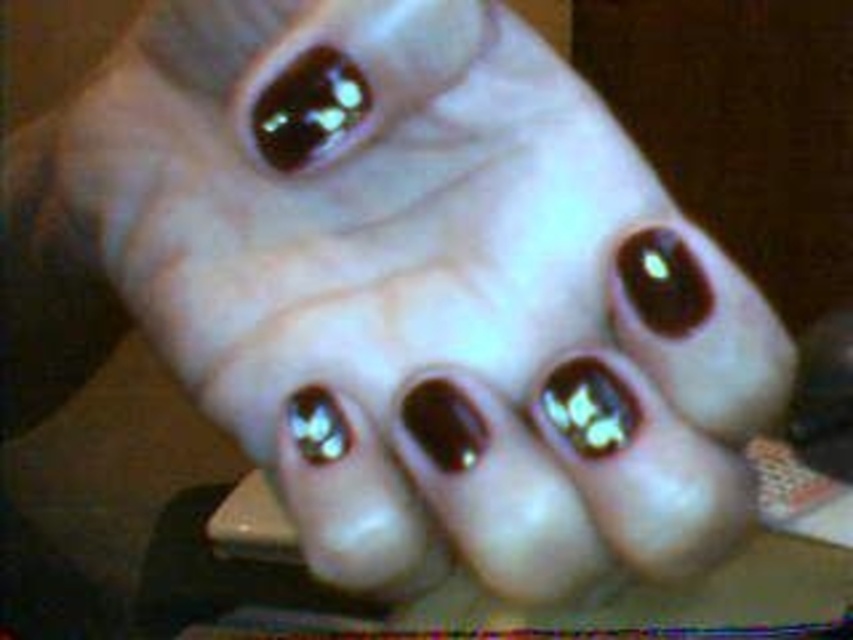
Which is in front, point (282, 161) or point (292, 403)?

Positioned in front is point (292, 403).

Is point (258, 104) positioned behind point (305, 432)?

That is True.

Is point (300, 60) positioned behind point (318, 413)?

That is True.

Find the location of a particular element. The image size is (853, 640). shiny dark brown nail polish at upper center is located at coordinates (309, 108).